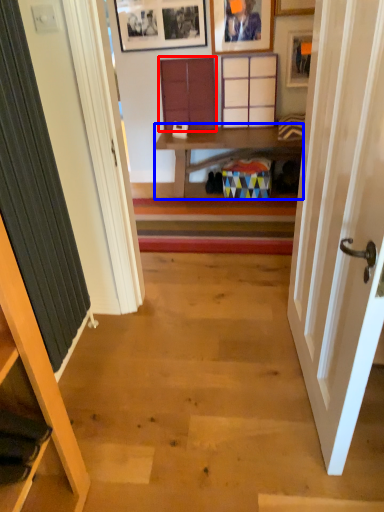
Question: Which of the following is the closest to the observer, cabinet (highlighted by a red box) or table (highlighted by a blue box)?

Choices:
 (A) cabinet
 (B) table

Answer: (B)